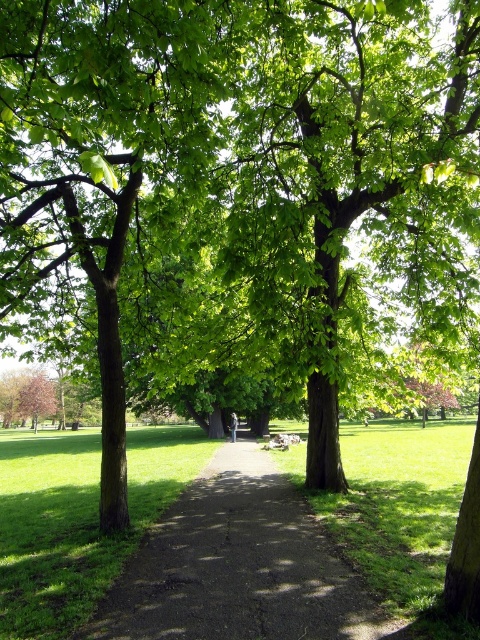
Question: Does dirt path at center come behind green grass at center?

Choices:
 (A) no
 (B) yes

Answer: (A)

Question: Which of the following is the closest to the observer?

Choices:
 (A) green grass at center
 (B) dirt path at center

Answer: (B)

Question: Is dirt path at center above green grass at center?

Choices:
 (A) no
 (B) yes

Answer: (B)

Question: Which point appears farthest from the camera in this image?

Choices:
 (A) (79, 586)
 (B) (262, 612)

Answer: (A)

Question: Does dirt path at center appear on the right side of green grass at center?

Choices:
 (A) no
 (B) yes

Answer: (B)

Question: Which of the following is the farthest from the observer?

Choices:
 (A) dirt path at center
 (B) green grass at center

Answer: (B)